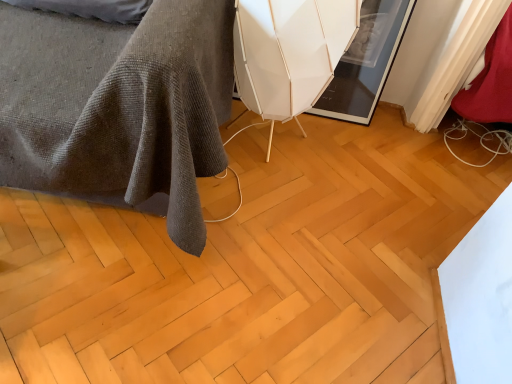
Question: Could you tell me if natural wood floor at center is facing white matte swivel chair at center?

Choices:
 (A) yes
 (B) no

Answer: (B)

Question: Considering the relative sizes of natural wood floor at center and white matte swivel chair at center in the image provided, is natural wood floor at center smaller than white matte swivel chair at center?

Choices:
 (A) yes
 (B) no

Answer: (A)

Question: Can you confirm if natural wood floor at center is bigger than white matte swivel chair at center?

Choices:
 (A) no
 (B) yes

Answer: (A)

Question: From a real-world perspective, is natural wood floor at center below white matte swivel chair at center?

Choices:
 (A) yes
 (B) no

Answer: (A)

Question: Is natural wood floor at center closer to the viewer compared to white matte swivel chair at center?

Choices:
 (A) yes
 (B) no

Answer: (A)

Question: From a real-world perspective, is white matte swivel chair at center positioned above or below natural wood floor at center?

Choices:
 (A) above
 (B) below

Answer: (A)

Question: In the image, is white matte swivel chair at center positioned in front of or behind natural wood floor at center?

Choices:
 (A) front
 (B) behind

Answer: (B)

Question: Which is correct: white matte swivel chair at center is inside natural wood floor at center, or outside of it?

Choices:
 (A) outside
 (B) inside

Answer: (A)

Question: Based on their positions, is white matte swivel chair at center located to the left or right of natural wood floor at center?

Choices:
 (A) right
 (B) left

Answer: (A)

Question: Looking at the image, does natural wood floor at center seem bigger or smaller compared to dark gray textured blanket at lower left?

Choices:
 (A) small
 (B) big

Answer: (A)

Question: Which is correct: natural wood floor at center is inside dark gray textured blanket at lower left, or outside of it?

Choices:
 (A) inside
 (B) outside

Answer: (B)

Question: From a real-world perspective, is natural wood floor at center positioned above or below dark gray textured blanket at lower left?

Choices:
 (A) above
 (B) below

Answer: (B)

Question: From the image's perspective, relative to dark gray textured blanket at lower left, is natural wood floor at center above or below?

Choices:
 (A) below
 (B) above

Answer: (A)

Question: Considering the positions of natural wood floor at center and white matte swivel chair at center in the image, is natural wood floor at center taller or shorter than white matte swivel chair at center?

Choices:
 (A) tall
 (B) short

Answer: (B)

Question: Considering their positions, is natural wood floor at center located in front of or behind white matte swivel chair at center?

Choices:
 (A) front
 (B) behind

Answer: (A)